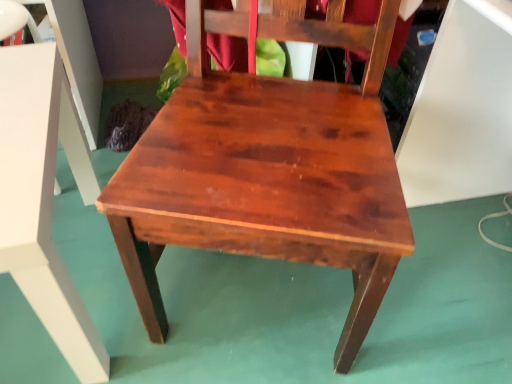
Identify the location of free spot below wooden table at center (from a real-world perspective). (27, 306).